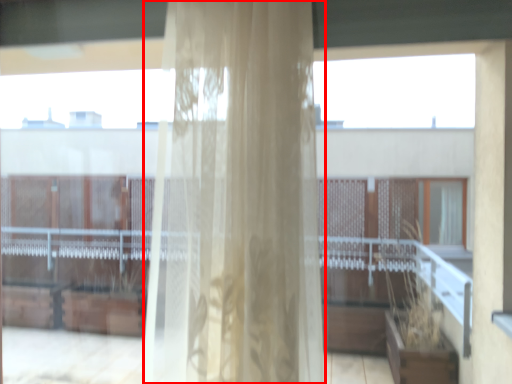
Question: Observing the image, what is the correct spatial positioning of curtain (annotated by the red box) in reference to glass window?

Choices:
 (A) left
 (B) right

Answer: (A)